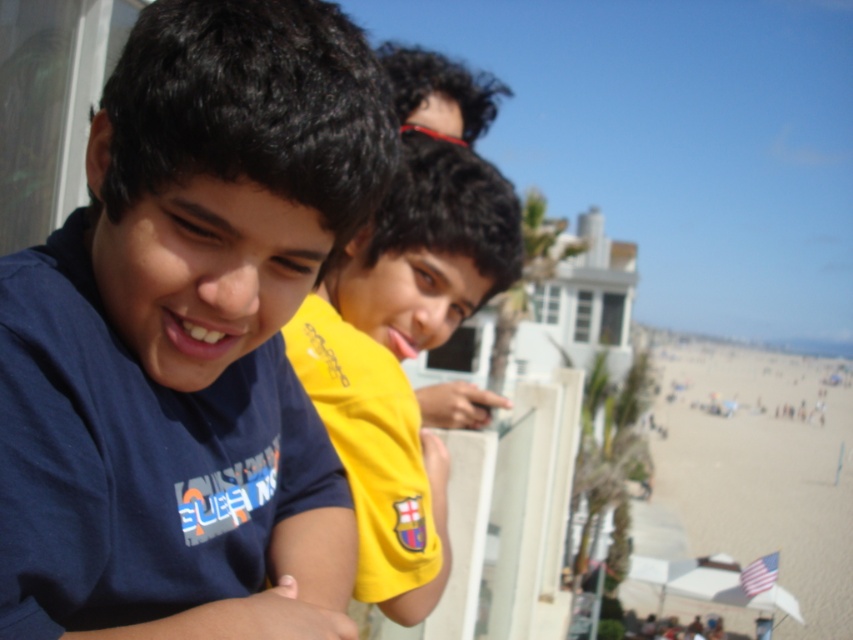
Question: Which point is closer to the camera?

Choices:
 (A) blue cotton shirt at left
 (B) yellow jersey at center

Answer: (A)

Question: Which point is closer to the camera?

Choices:
 (A) (402, 608)
 (B) (149, 160)

Answer: (B)

Question: Can you confirm if blue cotton shirt at left is positioned above yellow jersey at center?

Choices:
 (A) yes
 (B) no

Answer: (B)

Question: Can you confirm if blue cotton shirt at left is thinner than yellow jersey at center?

Choices:
 (A) no
 (B) yes

Answer: (B)

Question: Does blue cotton shirt at left appear on the left side of yellow jersey at center?

Choices:
 (A) no
 (B) yes

Answer: (B)